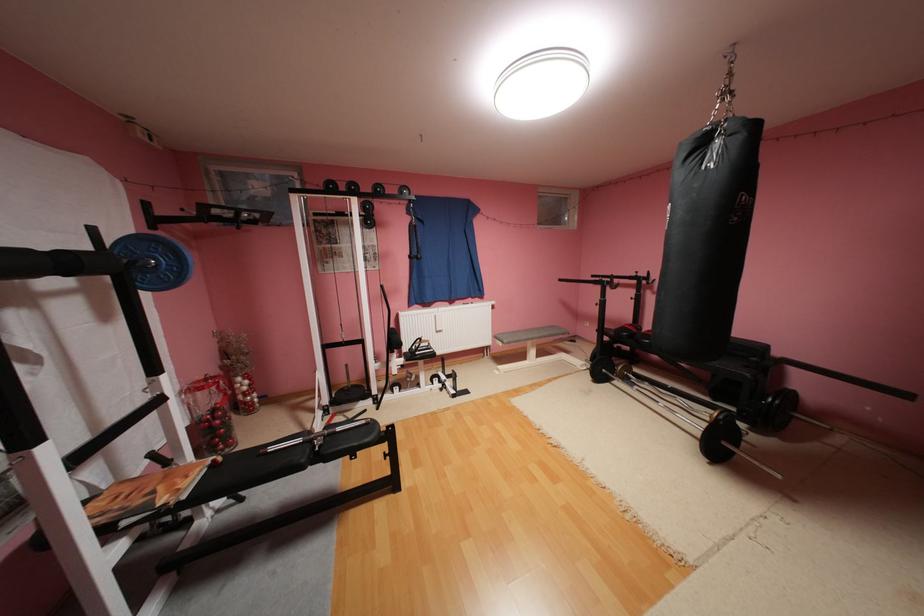
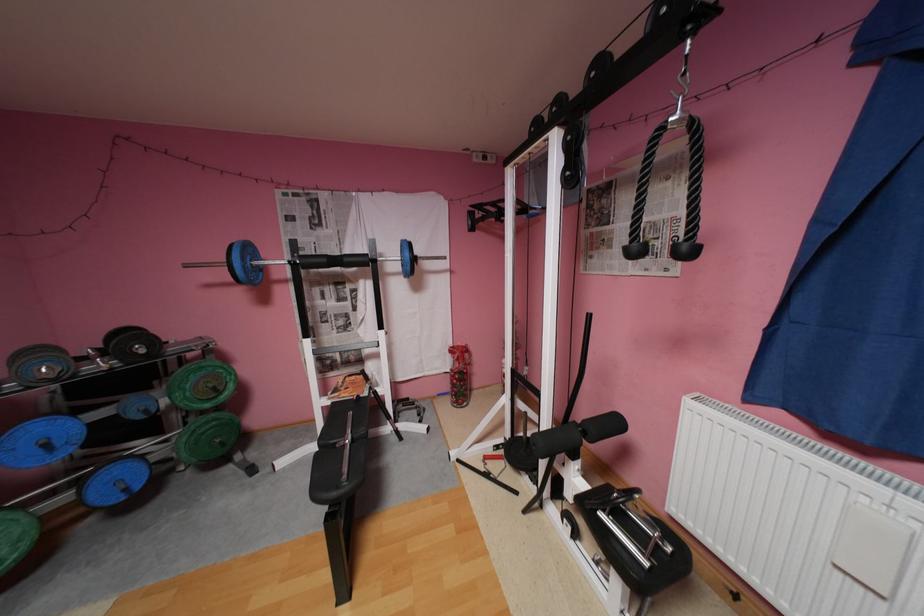
Find the pixel in the second image that matches pixel 223 418 in the first image.

(462, 377)